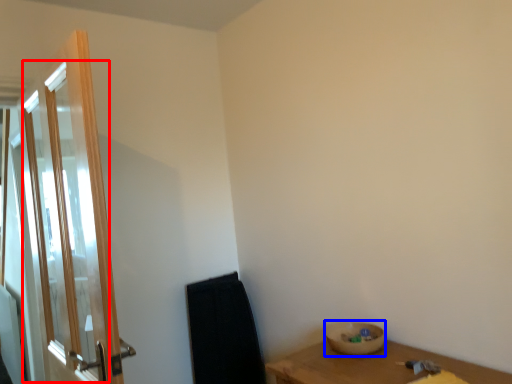
Question: Which object is closer to the camera taking this photo, screen door (highlighted by a red box) or basin (highlighted by a blue box)?

Choices:
 (A) screen door
 (B) basin

Answer: (A)